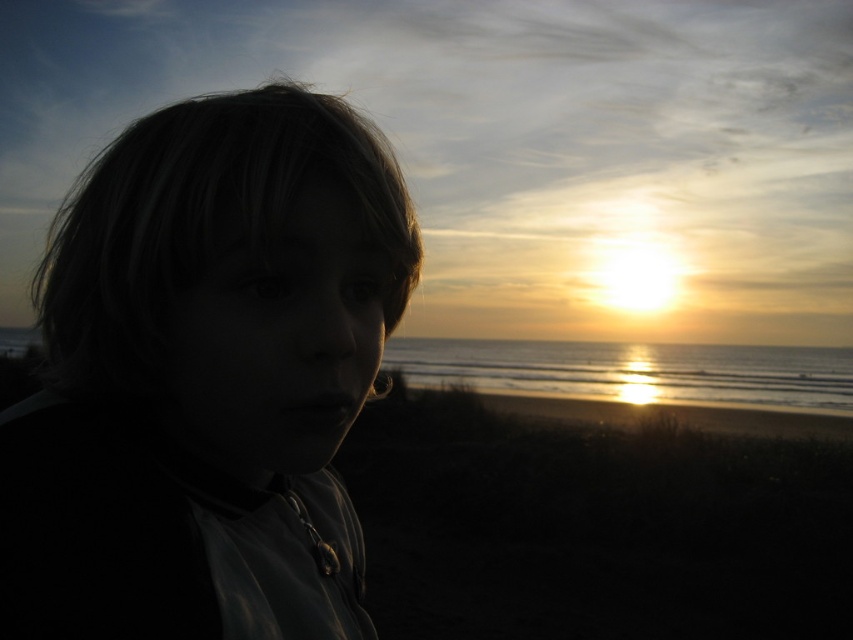
You are a photographer trying to capture the sunset scene. You notice the matte black hair at left and the glistening silver water at center. Which object appears narrower in the image?

The matte black hair at left has a lesser width compared to the glistening silver water at center, so it appears narrower in the image.

What are the coordinates of the matte black hair at left in the image?

The matte black hair at left is located at point (206, 378).